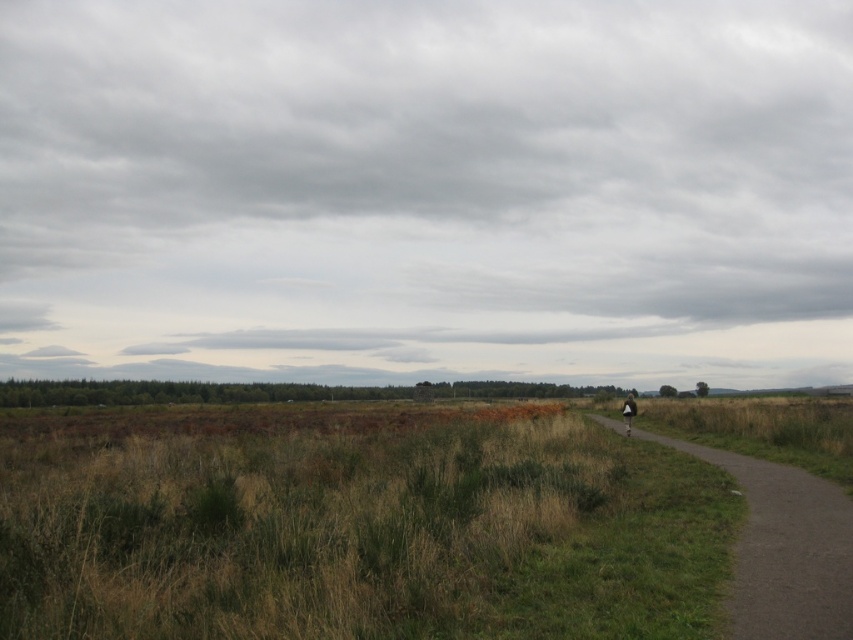
Who is shorter, dull gray asphalt path at right or white fabric bag at center-right?

Standing shorter between the two is dull gray asphalt path at right.

Is dull gray asphalt path at right positioned in front of white fabric bag at center-right?

Yes, dull gray asphalt path at right is in front of white fabric bag at center-right.

What do you see at coordinates (784, 548) in the screenshot? The image size is (853, 640). I see `dull gray asphalt path at right` at bounding box center [784, 548].

The image size is (853, 640). In order to click on dull gray asphalt path at right in this screenshot , I will do `click(784, 548)`.